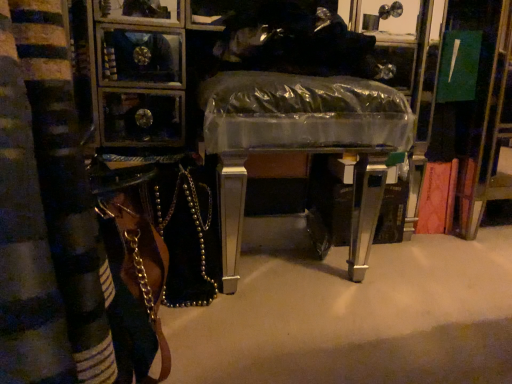
This screenshot has width=512, height=384. Find the location of `free location to the right of clear plastic table at center`. free location to the right of clear plastic table at center is located at coordinates (433, 276).